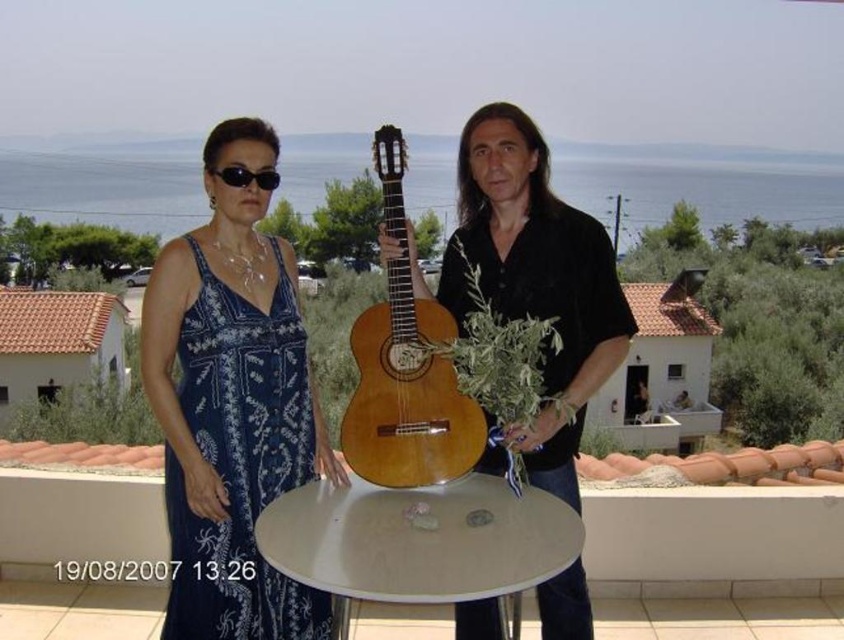
Image resolution: width=844 pixels, height=640 pixels. Describe the element at coordinates (542, 280) in the screenshot. I see `wooden guitar at center` at that location.

Is wooden guitar at center below blue printed fabric dress at left?

No.

The image size is (844, 640). I want to click on wooden guitar at center, so click(542, 280).

Locate an element on the screen. wooden guitar at center is located at coordinates (542, 280).

Is point (293, 595) positioned after point (226, 177)?

Yes, point (293, 595) is behind point (226, 177).

Which of these two, blue printed fabric dress at left or black plastic sunglasses at upper center, stands shorter?

black plastic sunglasses at upper center is shorter.

Is point (215, 300) farther from camera compared to point (233, 172)?

No.

The height and width of the screenshot is (640, 844). Find the location of `blue printed fabric dress at left`. blue printed fabric dress at left is located at coordinates (241, 461).

Is point (304, 612) in front of point (388, 376)?

That is False.

Who is more distant from viewer, (x=225, y=572) or (x=387, y=170)?

The point (x=225, y=572) is behind.

Image resolution: width=844 pixels, height=640 pixels. What are the coordinates of `wooden guitar at center` in the screenshot? It's located at (542, 280).